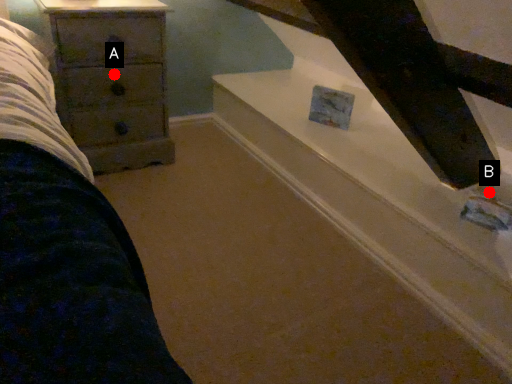
Question: Two points are circled on the image, labeled by A and B beside each circle. Which point appears farthest from the camera in this image?

Choices:
 (A) A is further
 (B) B is further

Answer: (A)